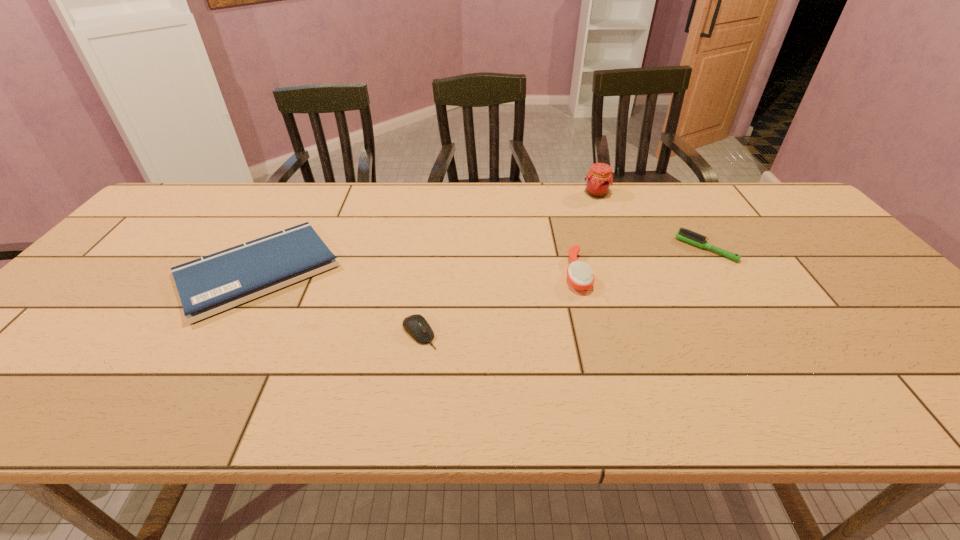
This screenshot has height=540, width=960. In order to click on free space between the fourth object from right to left and the right hairbrush in this screenshot , I will do [x=563, y=291].

The height and width of the screenshot is (540, 960). Identify the location of vacant space in between the third object from right to left and the shorter hairbrush. (641, 261).

This screenshot has height=540, width=960. I want to click on free space that is in between the second object from left to right and the farthest object, so click(x=508, y=264).

Where is `vacant point located between the second object from right to left and the left hairbrush`? The height and width of the screenshot is (540, 960). vacant point located between the second object from right to left and the left hairbrush is located at coordinates (587, 233).

You are a GUI agent. You are given a task and a screenshot of the screen. Output one action in this format:
    pyautogui.click(x=<x>, y=<y>)
    Task: Click on the free space between the fourth shortest object and the paperback book
    The width and height of the screenshot is (960, 540).
    Given the screenshot: What is the action you would take?
    pyautogui.click(x=418, y=272)

Find the location of a particular element. The width and height of the screenshot is (960, 540). free area in between the paperback book and the jam is located at coordinates (427, 232).

Identify the location of vacant region between the paperback book and the fourth object from right to left. pyautogui.click(x=339, y=302).

Identify the location of free space that is in between the paperback book and the jam. (427, 232).

Identify the location of blank region between the tallest object and the fourth object from right to left. Image resolution: width=960 pixels, height=540 pixels. (508, 264).

At what (x,y) coordinates should I click in order to perform the action: click on object that is the second closest to the right hairbrush. Please return your answer as a coordinate pair (x, y). Looking at the image, I should click on (580, 276).